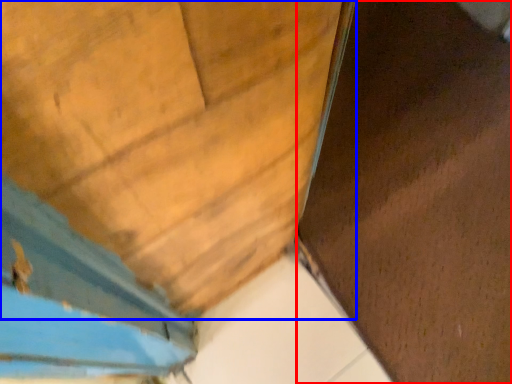
Question: Which object appears closest to the camera in this image, plywood (highlighted by a red box) or door (highlighted by a blue box)?

Choices:
 (A) plywood
 (B) door

Answer: (B)